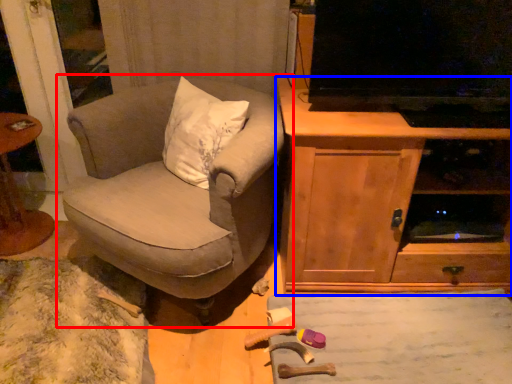
Question: Which object is closer to the camera taking this photo, chair (highlighted by a red box) or cabinetry (highlighted by a blue box)?

Choices:
 (A) chair
 (B) cabinetry

Answer: (A)